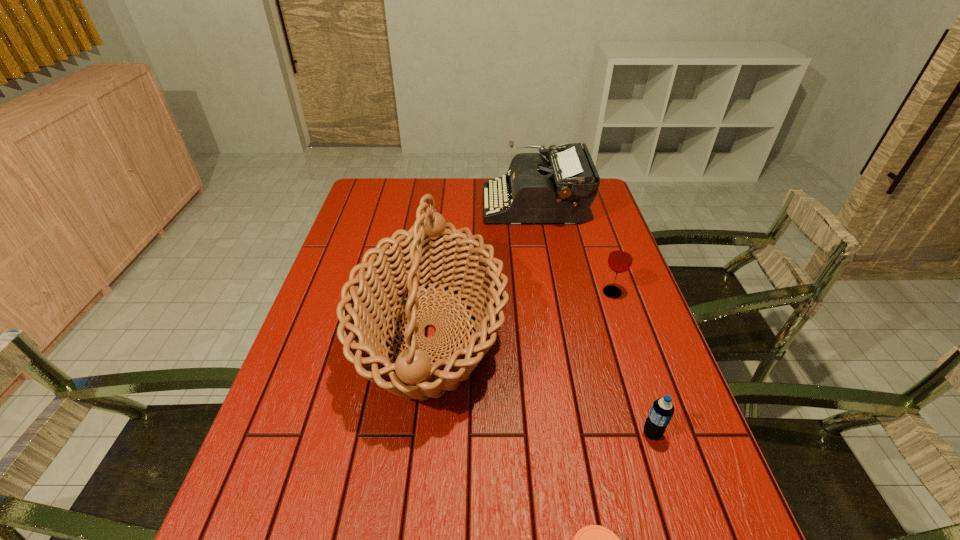
This screenshot has width=960, height=540. Identify the location of basket. (427, 254).

The image size is (960, 540). I want to click on typewriter, so click(561, 190).

You are a GUI agent. You are given a task and a screenshot of the screen. Output one action in this format:
    pyautogui.click(x=<x>, y=<y>)
    Task: Click on the glass
    The image size is (960, 540).
    Given the screenshot: What is the action you would take?
    pyautogui.click(x=620, y=259)

Image resolution: width=960 pixels, height=540 pixels. Find the location of `the second shortest object`. the second shortest object is located at coordinates (662, 410).

Where is `vacant space situated 0.310m on the right of the basket`? This screenshot has width=960, height=540. vacant space situated 0.310m on the right of the basket is located at coordinates (624, 334).

Find the location of a particular element. The height and width of the screenshot is (540, 960). vacant region located on the front-facing side of the farthest object is located at coordinates (444, 205).

At what (x,y) coordinates should I click in order to perform the action: click on vacant space located on the front-facing side of the farthest object. Please return your answer as a coordinate pair (x, y). This screenshot has width=960, height=540. Looking at the image, I should click on (462, 205).

This screenshot has height=540, width=960. Identify the location of vacant space situated 0.050m on the front-facing side of the farthest object. (470, 205).

Find the location of a particular element. vacant space located 0.340m on the back of the glass is located at coordinates (588, 220).

Identify the location of vacant region located 0.120m on the back of the soda bottle. (635, 379).